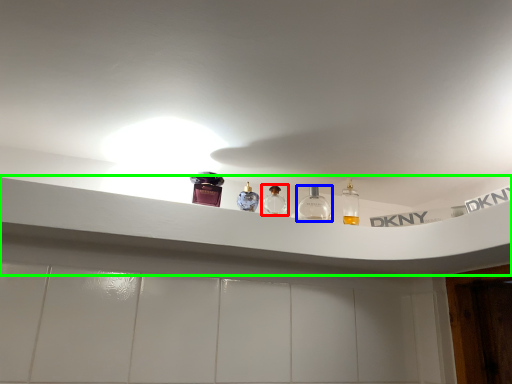
Question: Which object is positioned closest to bottle (highlighted by a red box)? Select from bottle (highlighted by a blue box) and window sill (highlighted by a green box).

Choices:
 (A) bottle
 (B) window sill

Answer: (A)